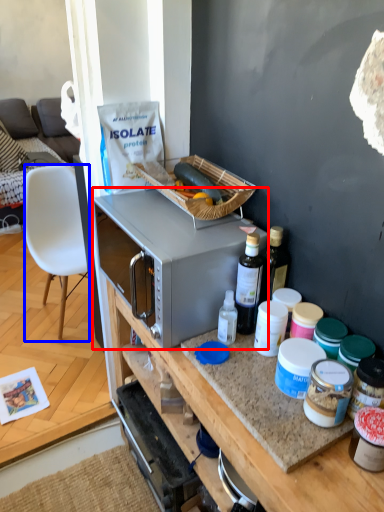
Question: Which of the following is the closest to the observer, microwave oven (highlighted by a red box) or chair (highlighted by a blue box)?

Choices:
 (A) microwave oven
 (B) chair

Answer: (A)